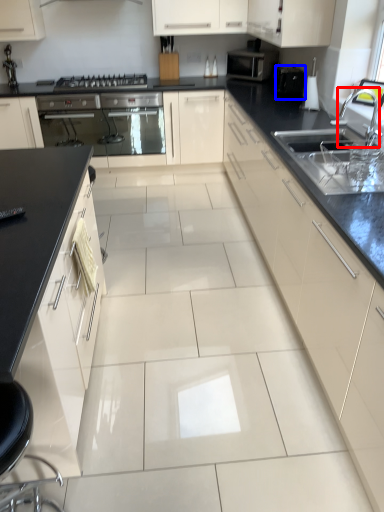
Question: Which point is closer to the camera, faucet (highlighted by a red box) or appliance (highlighted by a blue box)?

Choices:
 (A) faucet
 (B) appliance

Answer: (A)